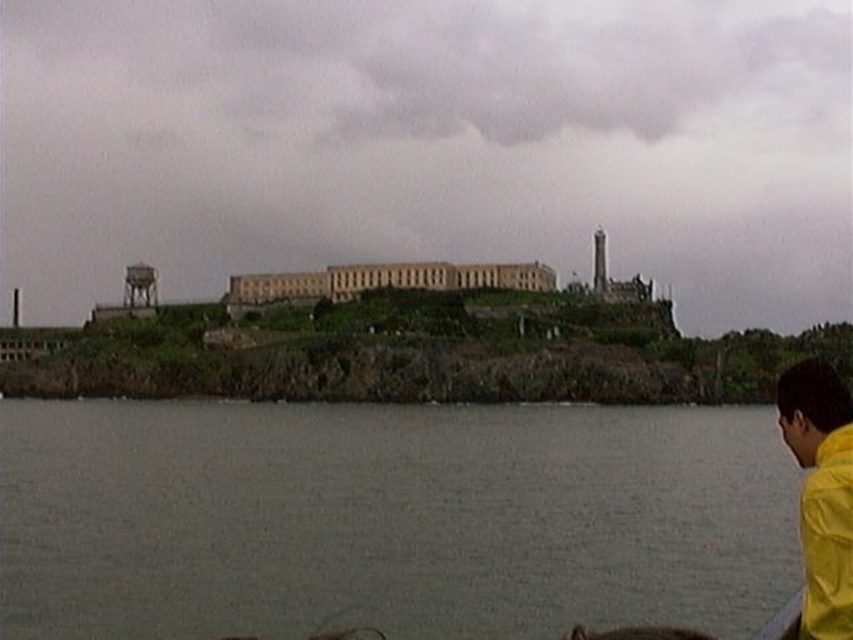
You are standing on the dock and see the gray water at lower center and the yellow matte jacket at lower right. Which object takes up more area in the image?

The yellow matte jacket at lower right occupies more space than the gray water at lower center according to the description.

You are standing at the point marked by the coordinates point [387,518] in the image. What do you see immediately around you?

You see gray water at lower center around you.